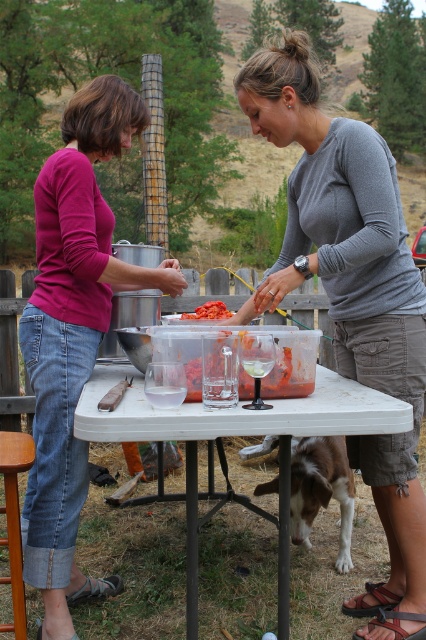
Question: Does brown and white fur at under table appear on the left side of wooden stool at lower left?

Choices:
 (A) no
 (B) yes

Answer: (A)

Question: Which point is closer to the camera?

Choices:
 (A) (17, 529)
 (B) (190, 316)
 (C) (342, 524)
 (D) (265, 129)

Answer: (A)

Question: Which point is closer to the camera taking this photo?

Choices:
 (A) (281, 404)
 (B) (17, 531)

Answer: (A)

Question: Which point is farther to the camera?

Choices:
 (A) bright red diced tomatoes at center
 (B) gray cotton shirt at center
 (C) matte pink shirt at left
 (D) brown and white fur at under table

Answer: (D)

Question: Does wooden stool at lower left come behind bright red diced tomatoes at center?

Choices:
 (A) yes
 (B) no

Answer: (B)

Question: Can you confirm if gray cotton shirt at center is positioned to the right of wooden stool at lower left?

Choices:
 (A) yes
 (B) no

Answer: (A)